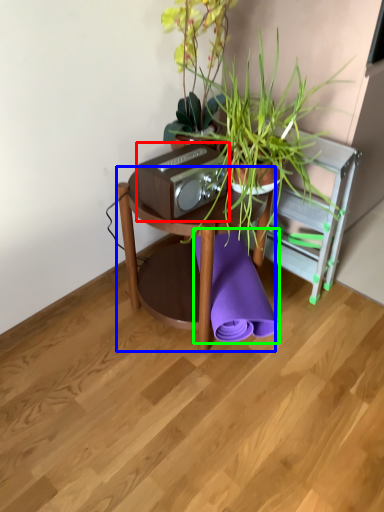
Question: Based on their relative distances, which object is farther from stereo (highlighted by a red box)? Choose from table (highlighted by a blue box) and beach towel (highlighted by a green box).

Choices:
 (A) table
 (B) beach towel

Answer: (B)